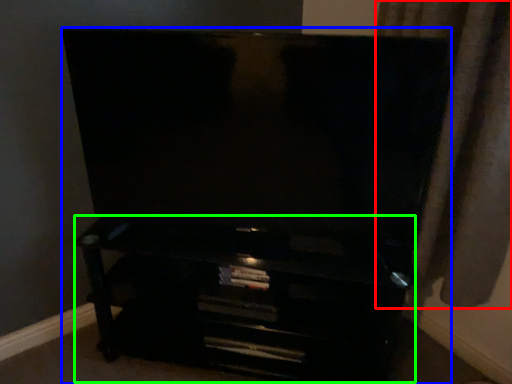
Question: Based on their relative distances, which object is farther from curtain (highlighted by a red box)? Choose from furniture (highlighted by a blue box) and entertainment center (highlighted by a green box).

Choices:
 (A) furniture
 (B) entertainment center

Answer: (B)